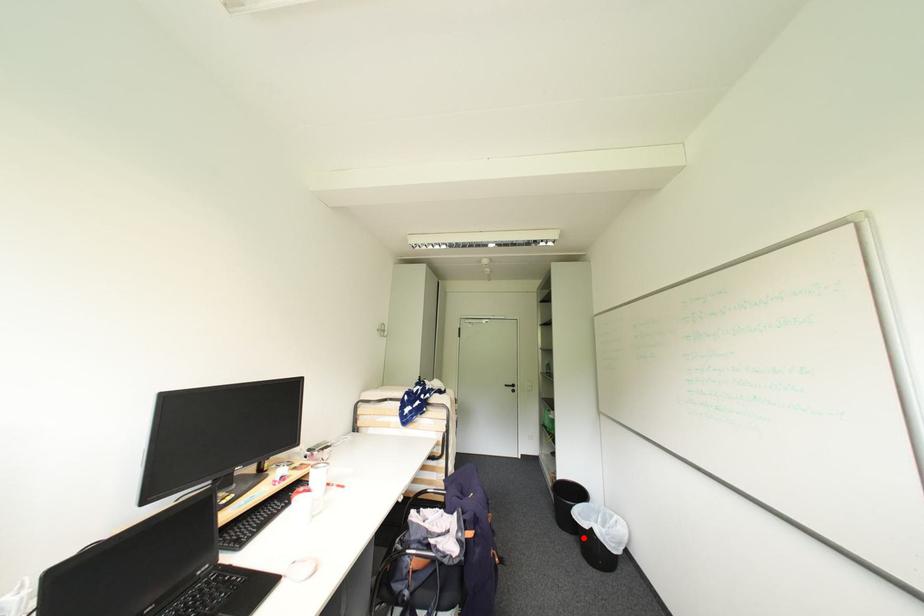
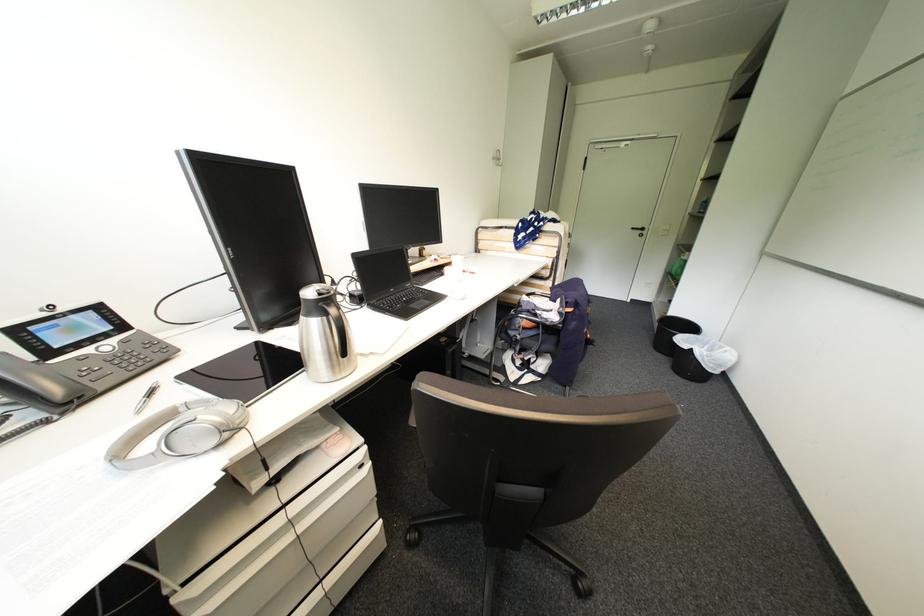
Question: A red point is marked in image1. In image2, is the corresponding 3D point closer to the camera or farther? Reply with the corresponding letter.

Choices:
 (A) The corresponding 3D point is closer.
 (B) The corresponding 3D point is farther.

Answer: (A)